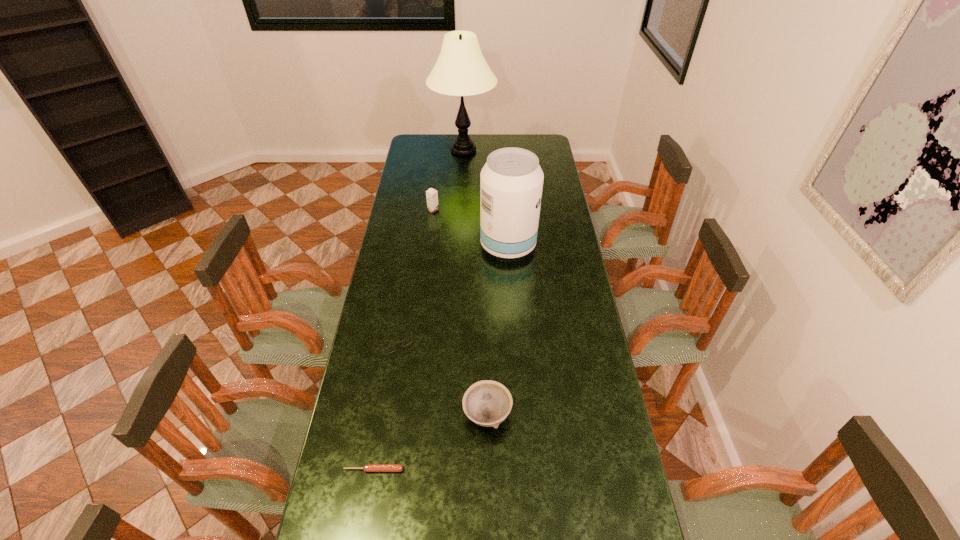
Where is `free space that is in between the third shortest object and the shortest object`? free space that is in between the third shortest object and the shortest object is located at coordinates (431, 442).

Where is `free space between the farthest object and the spectacles`? The width and height of the screenshot is (960, 540). free space between the farthest object and the spectacles is located at coordinates (429, 246).

You are a GUI agent. You are given a task and a screenshot of the screen. Output one action in this format:
    pyautogui.click(x=<x>, y=<y>)
    Task: Click on the free area in between the sausage and the second tallest object
    The width and height of the screenshot is (960, 540).
    Given the screenshot: What is the action you would take?
    pyautogui.click(x=441, y=357)

Image resolution: width=960 pixels, height=540 pixels. Identify the location of vacant area that lies between the farthest object and the third tallest object. (448, 180).

In order to click on free spot between the second shortest object and the lamp in this screenshot , I will do `click(429, 246)`.

Find the location of a particular element. This screenshot has width=960, height=540. empty space between the nearest object and the second tallest object is located at coordinates (441, 357).

In order to click on free space between the third nearest object and the fourth shortest object in this screenshot , I will do `click(414, 276)`.

Identify the location of free point between the bowl and the fifth nearest object. (460, 312).

This screenshot has width=960, height=540. Find the location of `object that is the fourth closest to the alcohol`. object that is the fourth closest to the alcohol is located at coordinates (487, 403).

Locate which object is the fourth closest to the fourth tallest object. Please provide its 2D coordinates. Your answer should be formatted as a tuple, i.e. [(x, y)], where the tuple contains the x and y coordinates of a point satisfying the conditions above.

[(432, 195)]